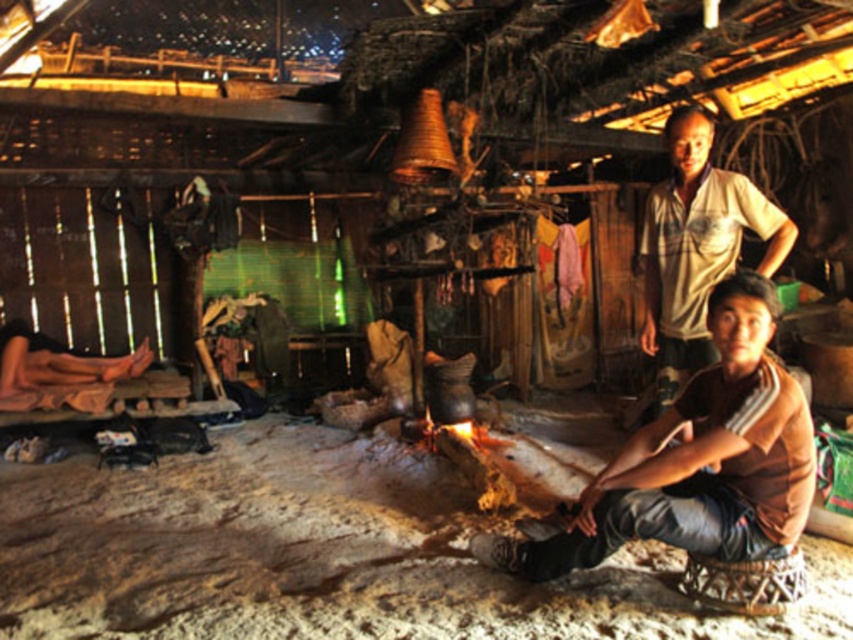
You are standing inside the rustic hut and notice two shirts hanging near the fire. The brown cotton shirt at lower right and the white cotton shirt at upper right. Which shirt is closer to you?

The brown cotton shirt at lower right is closer to you because it is in front of the white cotton shirt at upper right.

You are a traveler who needs to pack your belongings into a backpack. You have a white cotton shirt at upper right and brown leather sandals at lower left. Which item will take up less space horizontally when placed side by side?

The white cotton shirt at upper right has a lesser width compared to brown leather sandals at lower left, so it will take up less horizontal space.